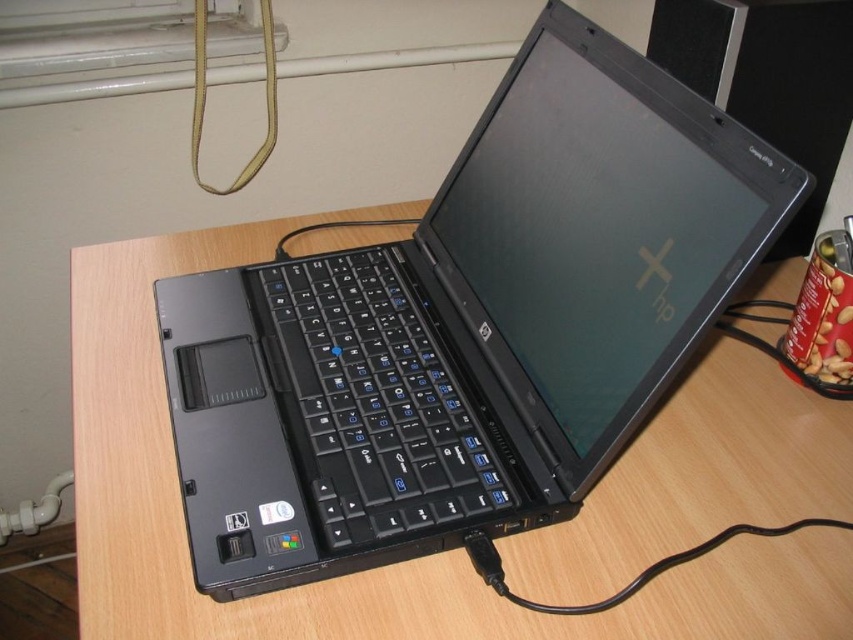
Question: Which point is closer to the camera taking this photo?

Choices:
 (A) (438, 394)
 (B) (352, 444)

Answer: (B)

Question: Can you confirm if black plastic laptop at center is smaller than black plastic keyboard at center?

Choices:
 (A) yes
 (B) no

Answer: (B)

Question: Does black plastic laptop at center appear under black plastic keyboard at center?

Choices:
 (A) yes
 (B) no

Answer: (B)

Question: Is black plastic laptop at center below black plastic keyboard at center?

Choices:
 (A) yes
 (B) no

Answer: (B)

Question: Which point appears farthest from the camera in this image?

Choices:
 (A) (346, 321)
 (B) (297, 312)

Answer: (B)